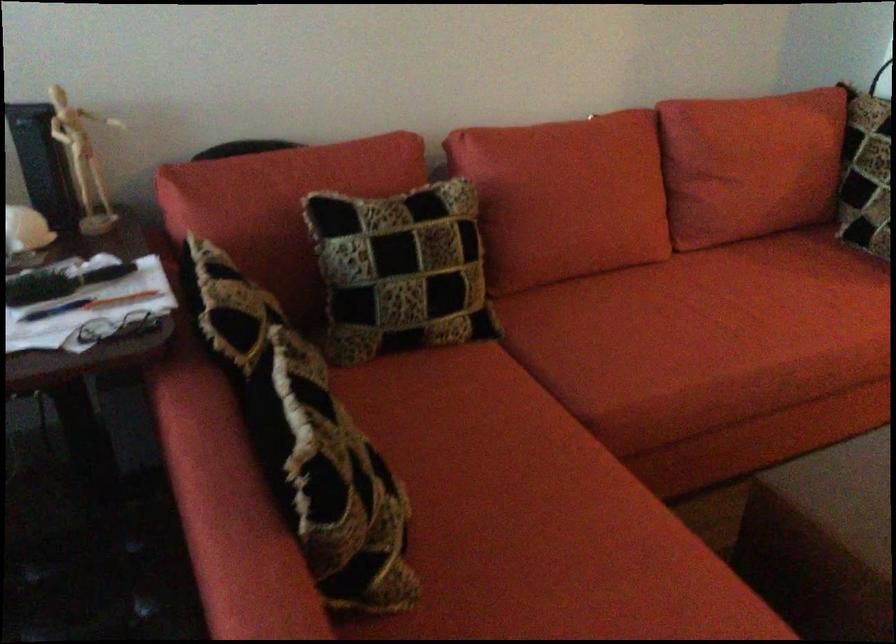
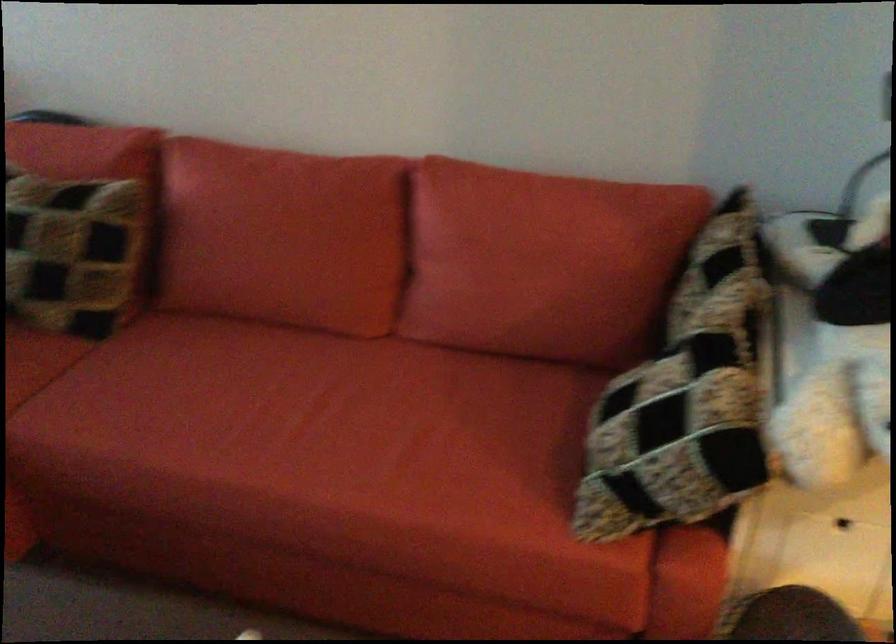
The point at (599, 187) is marked in the first image. Where is the corresponding point in the second image?

(282, 236)